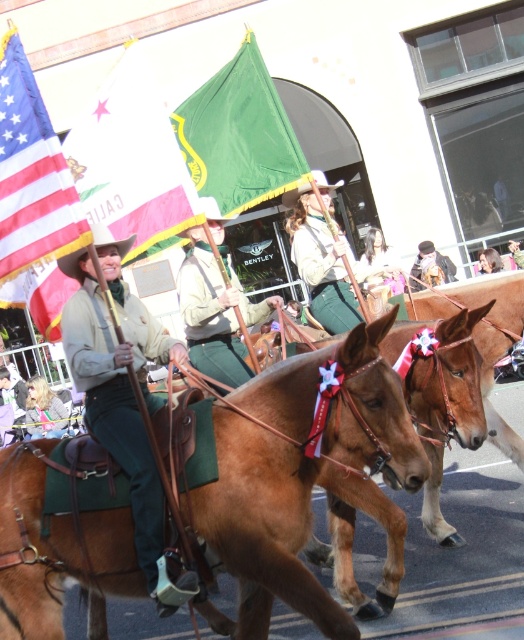
You are a photographer standing at the center of the parade route. You want to take a picture of the smooth brown leather hat at upper center. Where should you aim your camera to capture it?

You should aim your camera at point 0.411 on the x axis and 0.729 on the y axis to capture the smooth brown leather hat at upper center.

You are a photographer positioned at the front of the parade. You need to capture a photo that includes both the leather jacket at center and the blonde hair wig at center. Which object should you adjust your camera angle to focus on first to ensure both are in frame?

The leather jacket at center has a lesser width compared to the blonde hair wig at center, so you should focus on the leather jacket at center first to ensure both fit within the frame.